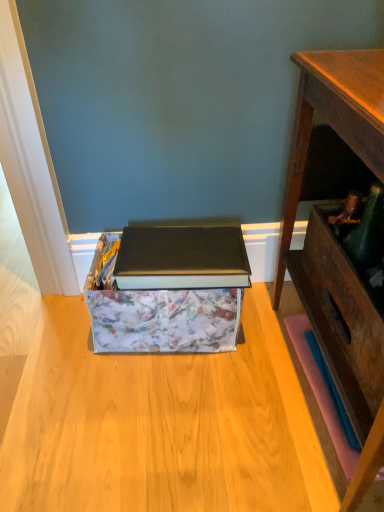
Question: From a real-world perspective, is wooden desk at right on floral-patterned cardboard box at center?

Choices:
 (A) yes
 (B) no

Answer: (A)

Question: Is wooden desk at right at the left side of floral-patterned cardboard box at center?

Choices:
 (A) no
 (B) yes

Answer: (A)

Question: Does wooden desk at right lie in front of floral-patterned cardboard box at center?

Choices:
 (A) yes
 (B) no

Answer: (A)

Question: Can you confirm if wooden desk at right is smaller than floral-patterned cardboard box at center?

Choices:
 (A) yes
 (B) no

Answer: (B)

Question: From the image's perspective, would you say wooden desk at right is shown under floral-patterned cardboard box at center?

Choices:
 (A) no
 (B) yes

Answer: (A)

Question: Would you say wooden desk at right is a long distance from floral-patterned cardboard box at center?

Choices:
 (A) no
 (B) yes

Answer: (A)

Question: From the image's perspective, is floral-patterned cardboard box at center beneath wooden desk at right?

Choices:
 (A) no
 (B) yes

Answer: (B)

Question: Does floral-patterned cardboard box at center have a lesser height compared to wooden desk at right?

Choices:
 (A) yes
 (B) no

Answer: (A)

Question: Does floral-patterned cardboard box at center have a greater height compared to wooden desk at right?

Choices:
 (A) yes
 (B) no

Answer: (B)

Question: Does floral-patterned cardboard box at center come behind wooden desk at right?

Choices:
 (A) no
 (B) yes

Answer: (B)

Question: Considering the relative sizes of floral-patterned cardboard box at center and wooden desk at right in the image provided, is floral-patterned cardboard box at center smaller than wooden desk at right?

Choices:
 (A) yes
 (B) no

Answer: (A)

Question: Is the position of floral-patterned cardboard box at center less distant than that of wooden desk at right?

Choices:
 (A) yes
 (B) no

Answer: (B)

Question: Considering the relative positions of floral-patterned cardboard box at center and wooden desk at right in the image provided, is floral-patterned cardboard box at center to the left or to the right of wooden desk at right?

Choices:
 (A) left
 (B) right

Answer: (A)